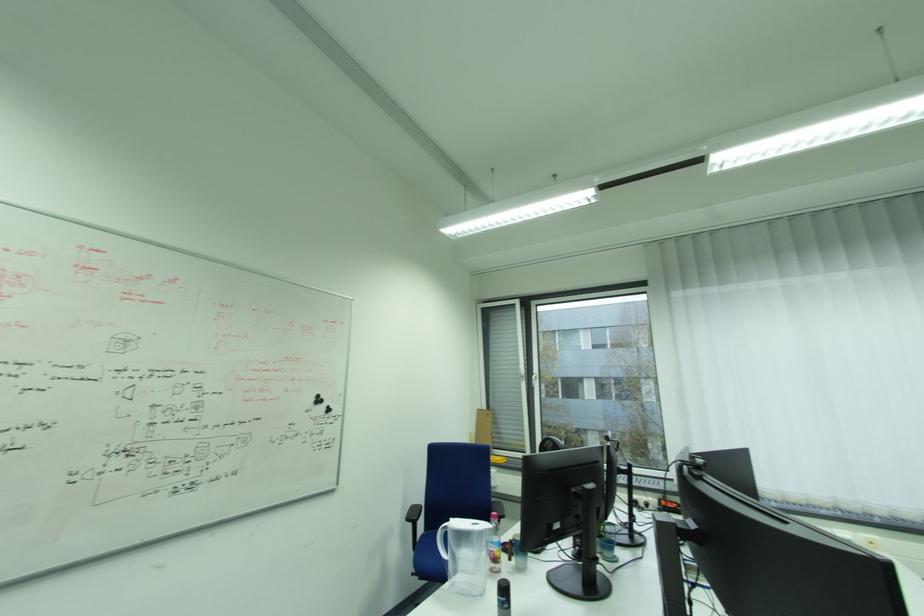
I want to click on black spray can, so click(504, 597).